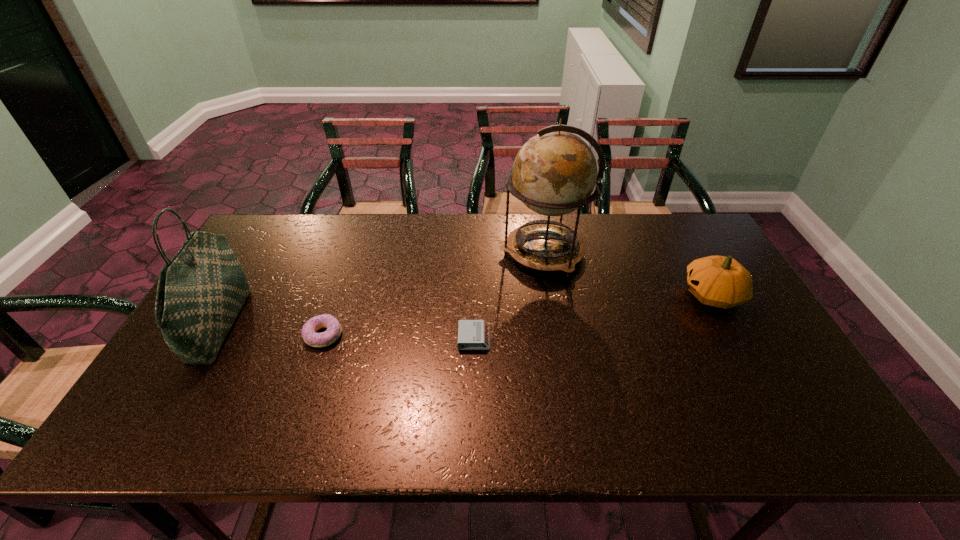
Identify the location of the tallest object. (554, 173).

Where is `the fourth object from left to right`? The image size is (960, 540). the fourth object from left to right is located at coordinates (554, 173).

At what (x,y) coordinates should I click in order to perform the action: click on tote bag. Please return your answer as a coordinate pair (x, y). The height and width of the screenshot is (540, 960). Looking at the image, I should click on (201, 290).

I want to click on the leftmost object, so click(x=201, y=290).

The height and width of the screenshot is (540, 960). Find the location of `the rightmost object`. the rightmost object is located at coordinates (719, 281).

Where is `the third shortest object`? the third shortest object is located at coordinates (719, 281).

Identify the location of the second object from left to right. The image size is (960, 540). (309, 329).

This screenshot has width=960, height=540. Find the location of `doughnut`. doughnut is located at coordinates (309, 329).

The width and height of the screenshot is (960, 540). I want to click on the shortest object, so click(472, 334).

Locate an element on the screen. The width and height of the screenshot is (960, 540). the third object from left to right is located at coordinates (472, 334).